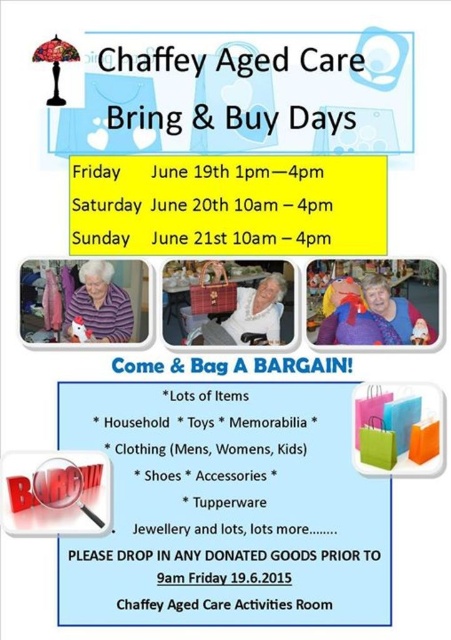
Identify the location of purple striped sweater at center. (100, 305).

Can you confirm if purple striped sweater at center is wider than orange matte shopping bag at lower right?

Correct, the width of purple striped sweater at center exceeds that of orange matte shopping bag at lower right.

Describe the element at coordinates (100, 305) in the screenshot. I see `purple striped sweater at center` at that location.

Where is `purple striped sweater at center`? Image resolution: width=451 pixels, height=640 pixels. purple striped sweater at center is located at coordinates (100, 305).

Is matte purple sweater at center positioned before green paper shopping bag at lower right?

No, matte purple sweater at center is behind green paper shopping bag at lower right.

Between matte purple sweater at center and green paper shopping bag at lower right, which one is positioned higher?

matte purple sweater at center is higher up.

Does point (343, 333) come closer to viewer compared to point (369, 420)?

No.

Find the location of a particular element. The width and height of the screenshot is (451, 640). matte purple sweater at center is located at coordinates (353, 317).

Is purple striped sweater at center further to the viewer compared to white fabric chair at center?

No, purple striped sweater at center is closer to the viewer.

You are a GUI agent. You are given a task and a screenshot of the screen. Output one action in this format:
    pyautogui.click(x=<x>, y=<y>)
    Task: Click on the purple striped sweater at center
    The image size is (451, 640).
    Given the screenshot: What is the action you would take?
    pyautogui.click(x=100, y=305)

Locate an element on the screen. The height and width of the screenshot is (640, 451). purple striped sweater at center is located at coordinates coord(100,305).